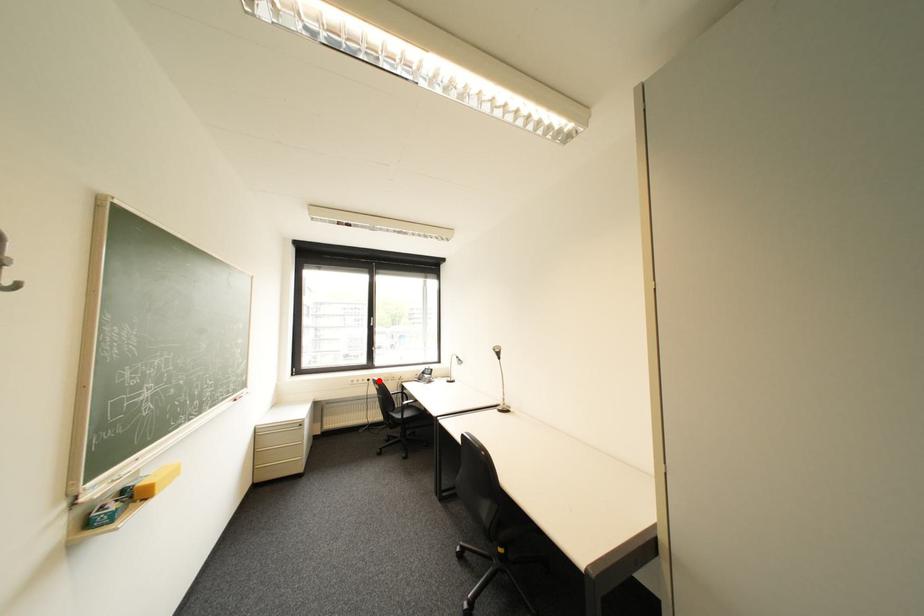
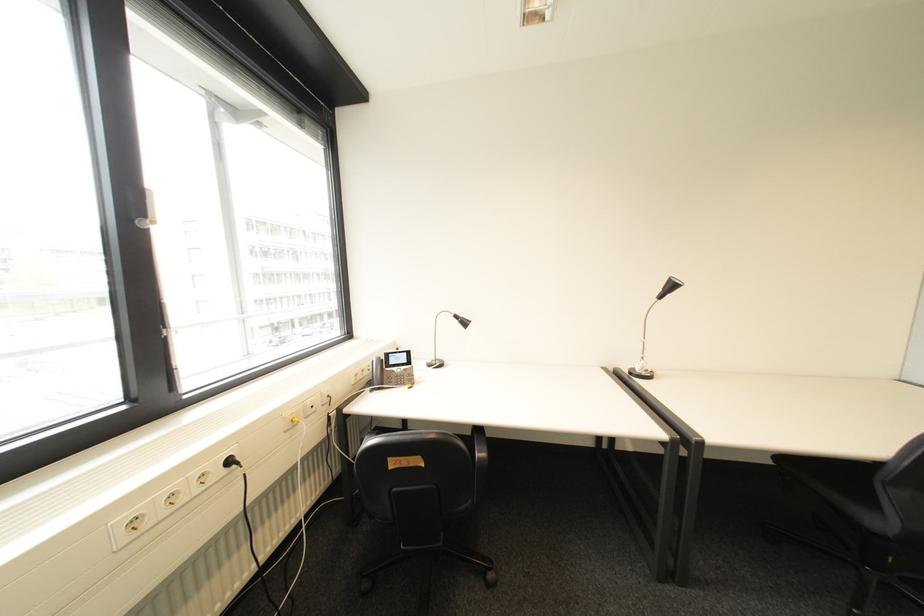
Question: I am providing you with two images of the same scene from different viewpoints. A red point is marked on the first image. At the location where the point appears in image 1, is it still visible in image 2?

Choices:
 (A) Yes
 (B) No

Answer: (A)